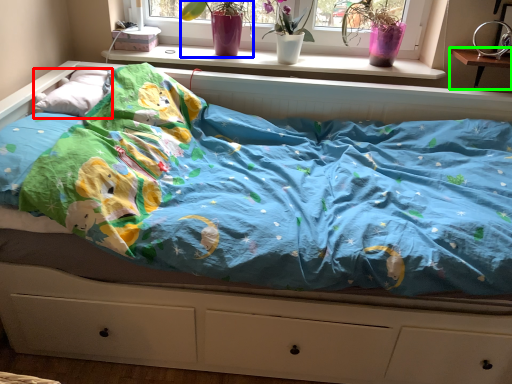
Question: Based on their relative distances, which object is farther from pillow (highlighted by a red box)? Choose from floral arrangement (highlighted by a blue box) and changing table (highlighted by a green box).

Choices:
 (A) floral arrangement
 (B) changing table

Answer: (B)